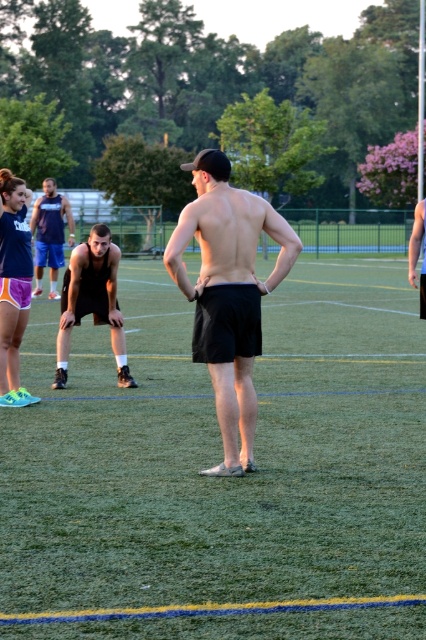
Question: Based on their relative distances, which object is farther from the black matte shorts at lower left?

Choices:
 (A) black athletic shorts at center
 (B) black matte shorts at center

Answer: (A)

Question: Which object appears farthest from the camera in this image?

Choices:
 (A) green artificial turf at center
 (B) black matte shorts at center
 (C) black matte shorts at lower left

Answer: (C)

Question: Is black matte shorts at center below black matte shorts at lower left?

Choices:
 (A) no
 (B) yes

Answer: (B)

Question: Does black matte shorts at lower left have a greater width compared to black athletic shorts at center?

Choices:
 (A) yes
 (B) no

Answer: (B)

Question: Can you confirm if black matte shorts at center is wider than black athletic shorts at center?

Choices:
 (A) no
 (B) yes

Answer: (A)

Question: Which of the following is the closest to the observer?

Choices:
 (A) (39, 236)
 (B) (46, 451)
 (C) (108, 292)
 (D) (253, 352)

Answer: (D)